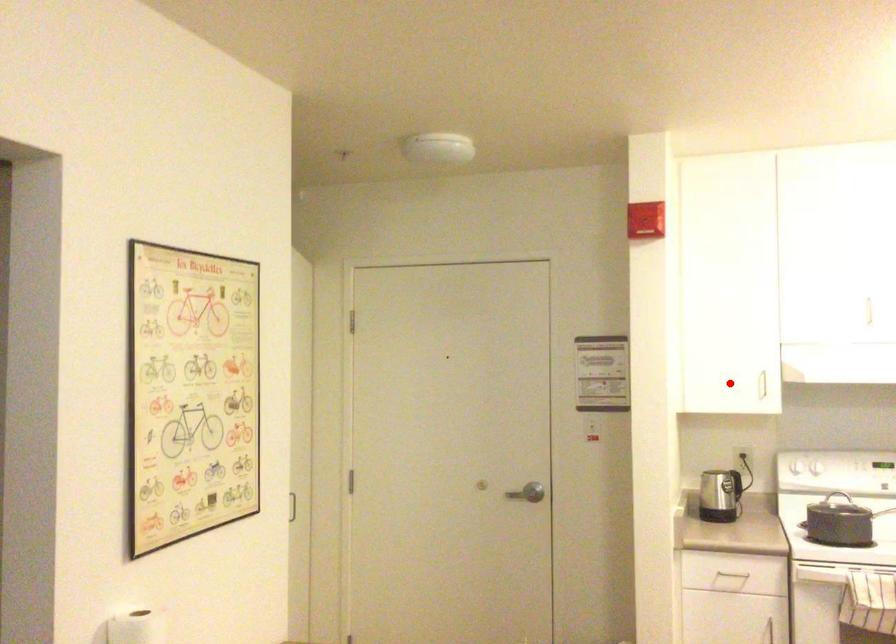
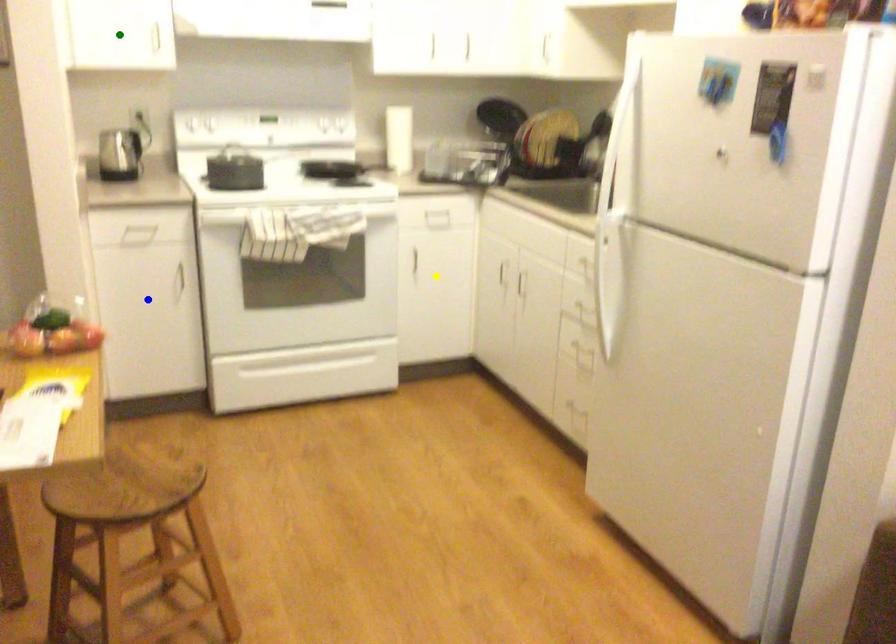
Question: I am providing you with two images of the same scene from different viewpoints. A red point is marked on the first image. You are given multiple points on the second image. Which point in image 2 is actually the same real-world point as the red point in image 1?

Choices:
 (A) yellow point
 (B) green point
 (C) blue point

Answer: (B)